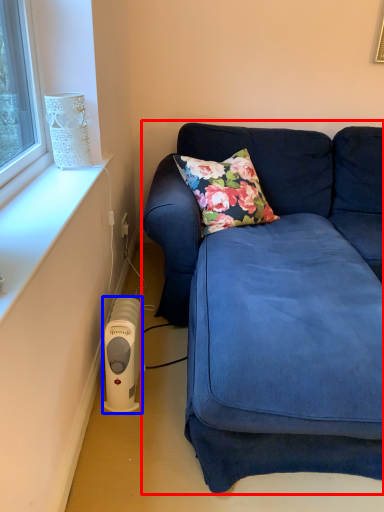
Question: Which object appears farthest to the camera in this image, studio couch (highlighted by a red box) or appliance (highlighted by a blue box)?

Choices:
 (A) studio couch
 (B) appliance

Answer: (B)